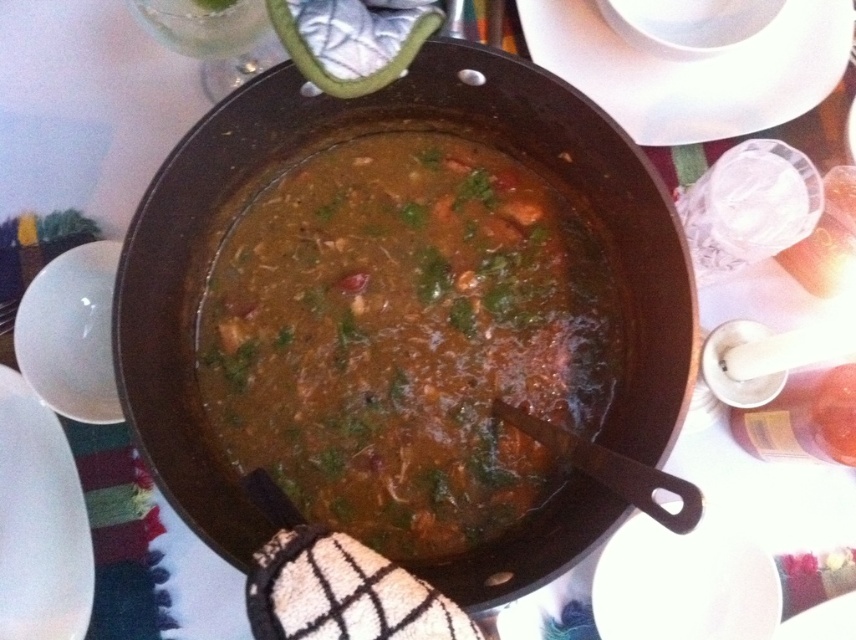
You are setting up a table for a dinner party and need to stack the plates vertically. Given the white glossy plate at upper center and the white matte plate at lower left, which plate should you place at the bottom of the stack to ensure stability?

The white glossy plate at upper center has a lesser height compared to the white matte plate at lower left, so placing the taller white matte plate at lower left at the bottom would provide better stability for the stack.

You are setting the table for a dinner party and need to place two white glossy plates. The scene shows a table with a dark pot of stew and other items. You have to place the white glossy plate at upper center and the white glossy plate at lower right. Which plate should you place closer to the edge of the table to ensure stability?

The white glossy plate at upper center is not as tall as the white glossy plate at lower right, so the plate at upper center is shorter and therefore more stable. Place the white glossy plate at upper center closer to the edge of the table for stability.